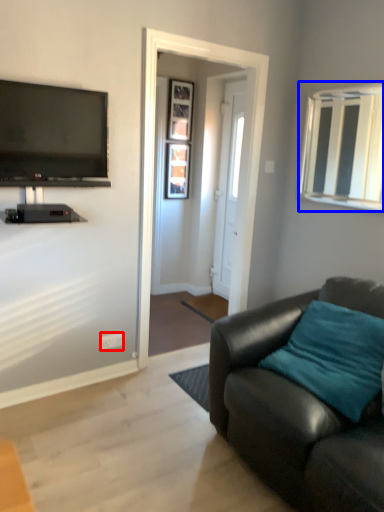
Question: Which object appears farthest to the camera in this image, power outlet (highlighted by a red box) or window (highlighted by a blue box)?

Choices:
 (A) power outlet
 (B) window

Answer: (A)